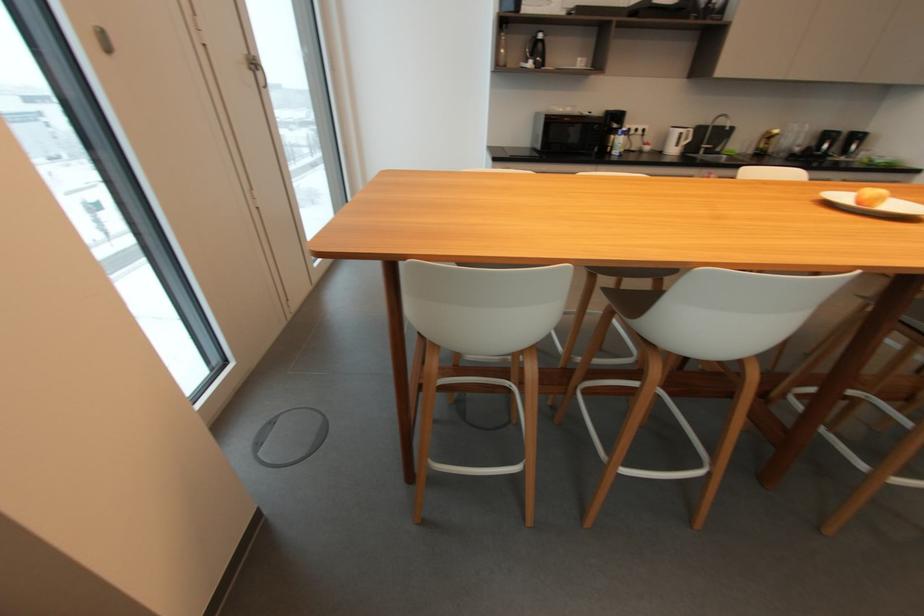
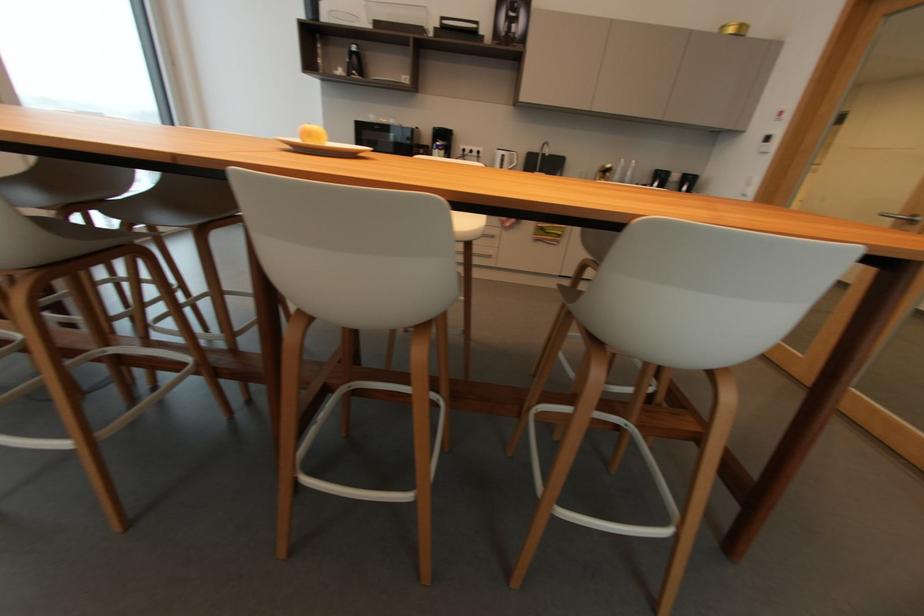
Question: Which direction would the cameraman need to move to produce the second image? Reply with the corresponding letter.

Choices:
 (A) Left
 (B) Right
 (C) Forward
 (D) Backward

Answer: (B)